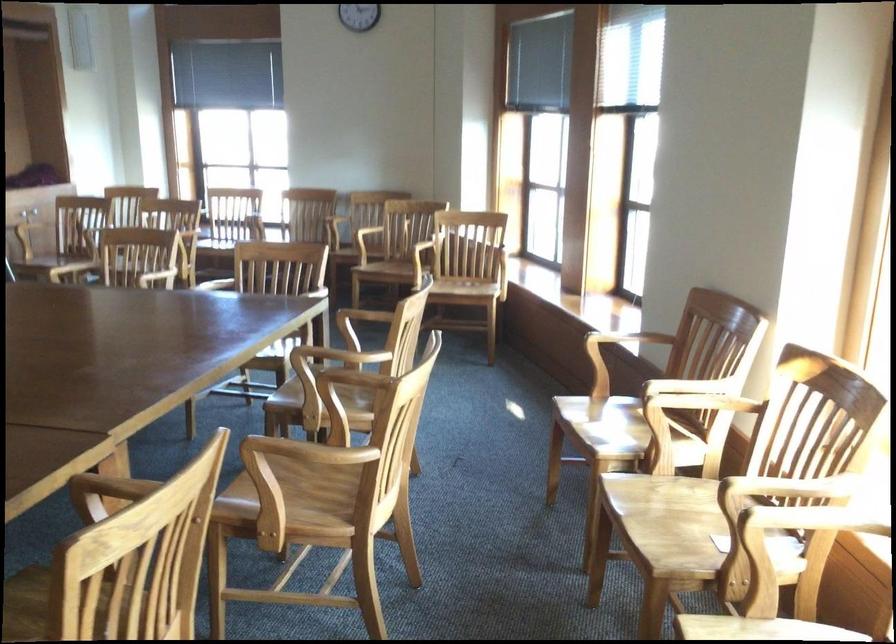
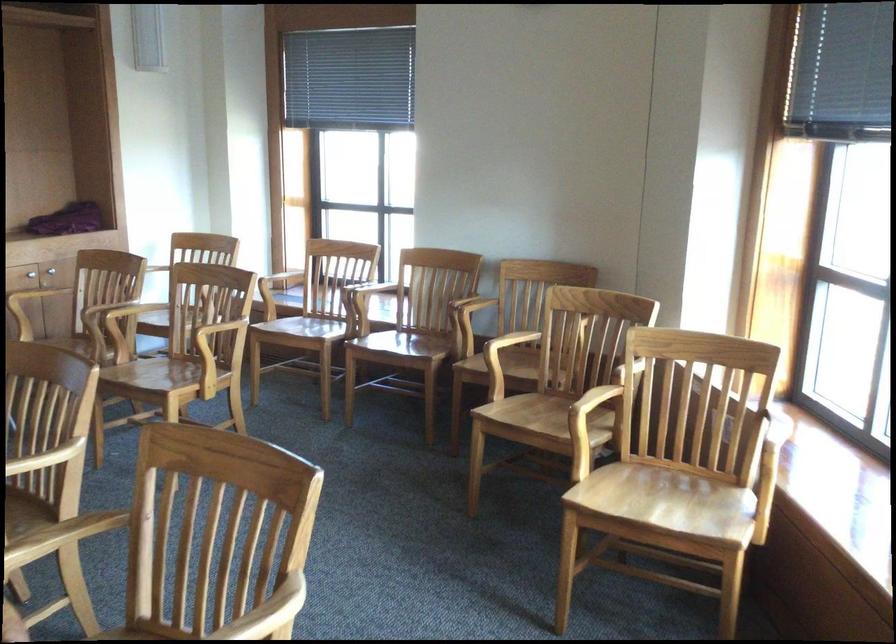
Question: The images are taken continuously from a first-person perspective. In which direction are you moving?

Choices:
 (A) Left
 (B) Right
 (C) Forward
 (D) Backward

Answer: (C)